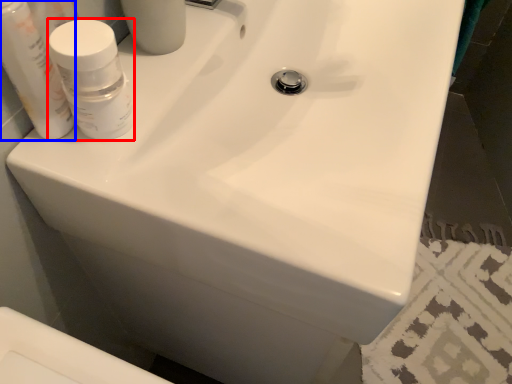
Question: Among these objects, which one is farthest to the camera, mouthwash (highlighted by a red box) or mouthwash (highlighted by a blue box)?

Choices:
 (A) mouthwash
 (B) mouthwash

Answer: (A)